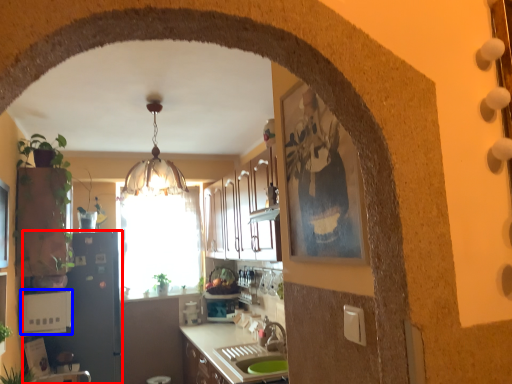
Question: Which of the following is the farthest to the observer, appliance (highlighted by a red box) or appliance (highlighted by a blue box)?

Choices:
 (A) appliance
 (B) appliance

Answer: (A)